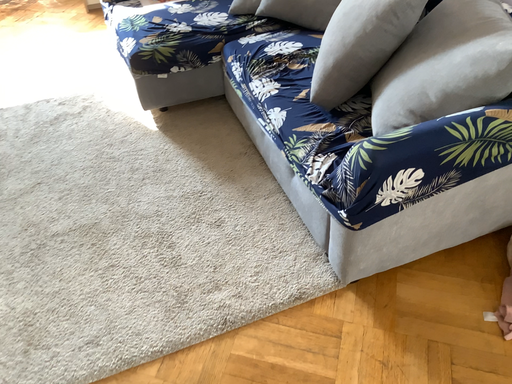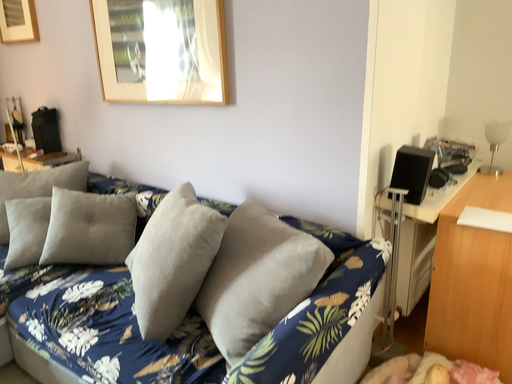
Question: How did the camera likely rotate when shooting the video?

Choices:
 (A) rotated downward
 (B) rotated upward

Answer: (B)